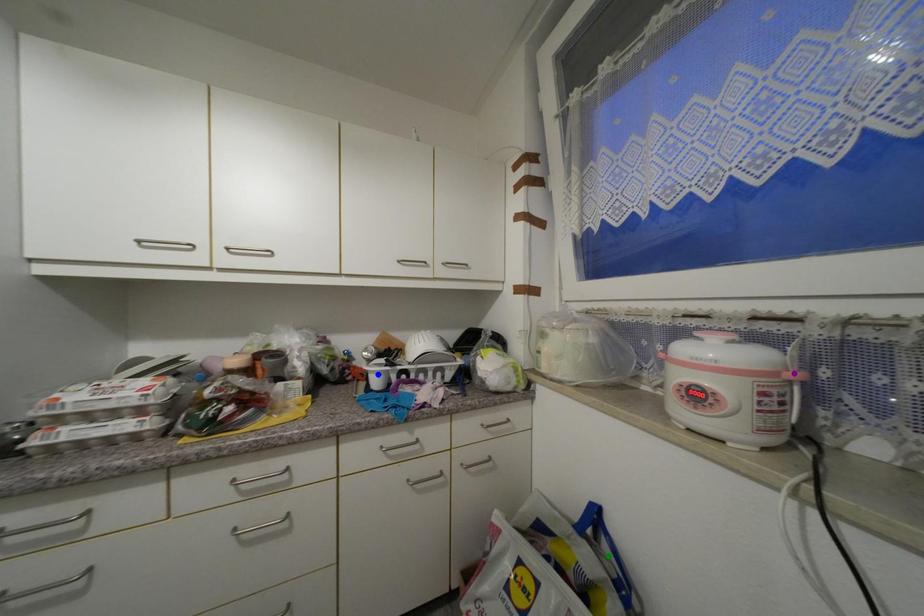
Order these from nearest to farthest:
green point
purple point
blue point

blue point, green point, purple point